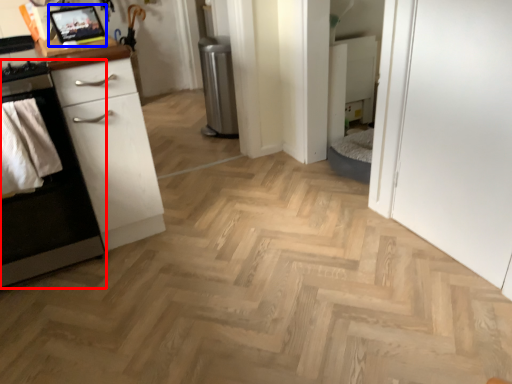
Question: Which of the following is the farthest to the observer, cabinetry (highlighted by a red box) or appliance (highlighted by a blue box)?

Choices:
 (A) cabinetry
 (B) appliance

Answer: (B)